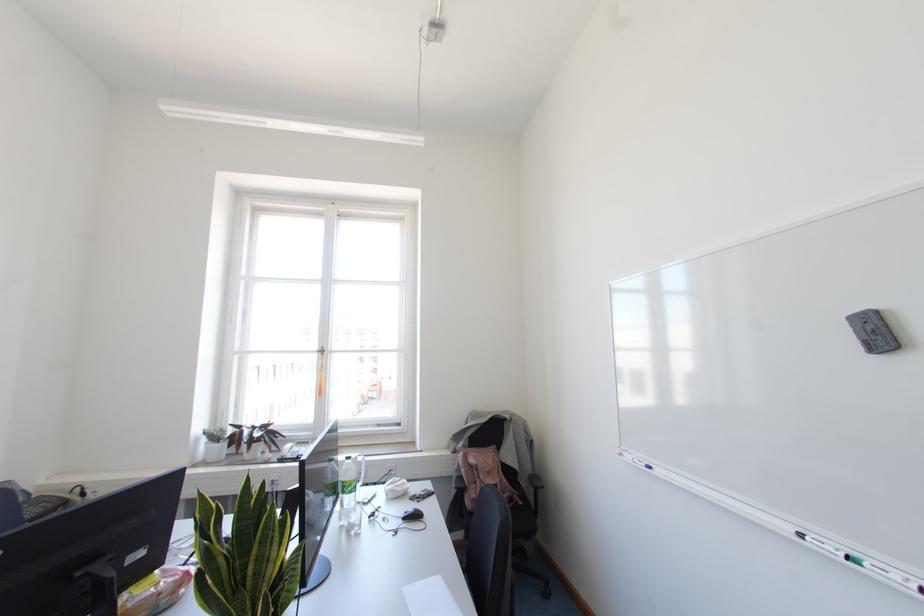
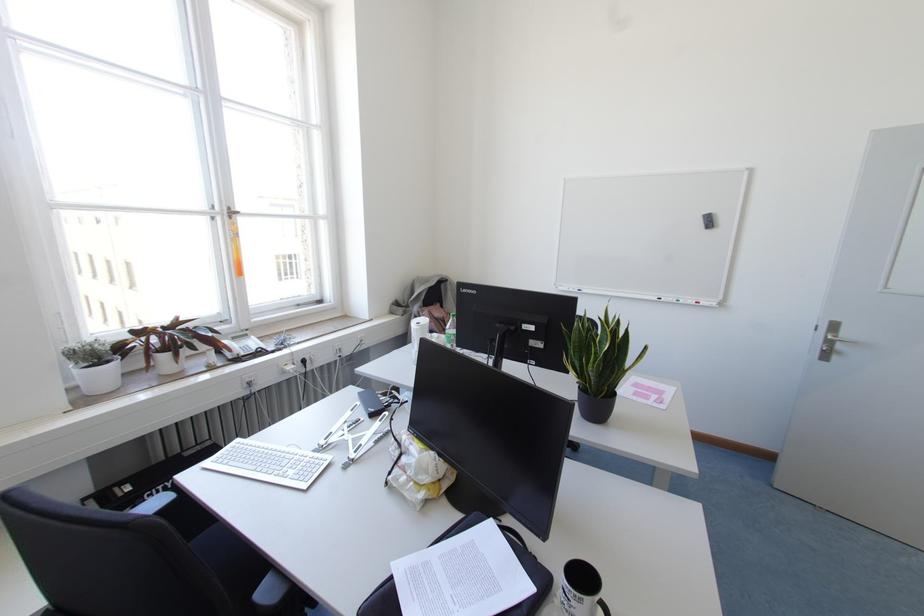
Locate, in the second image, the point that corresponds to point (299, 455) in the first image.

(258, 349)